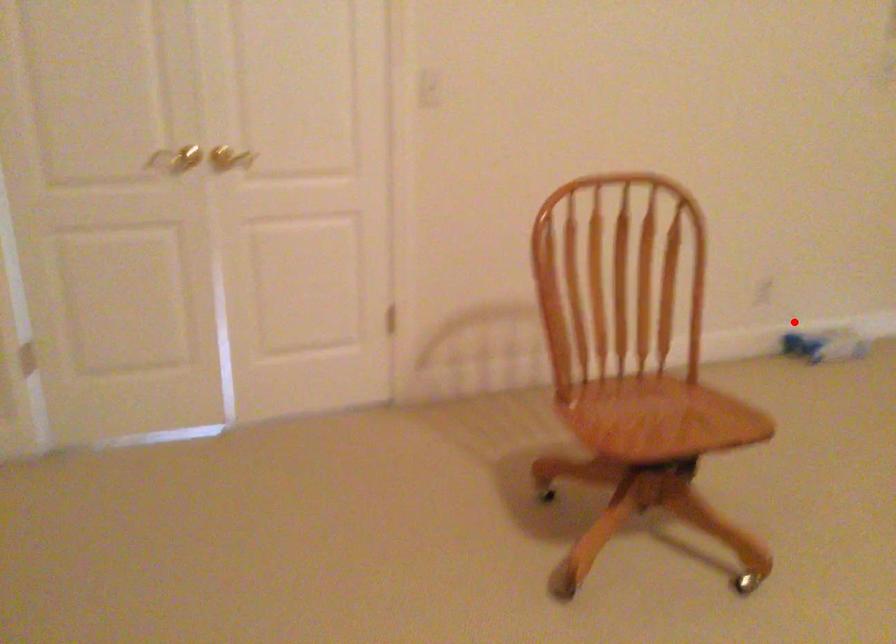
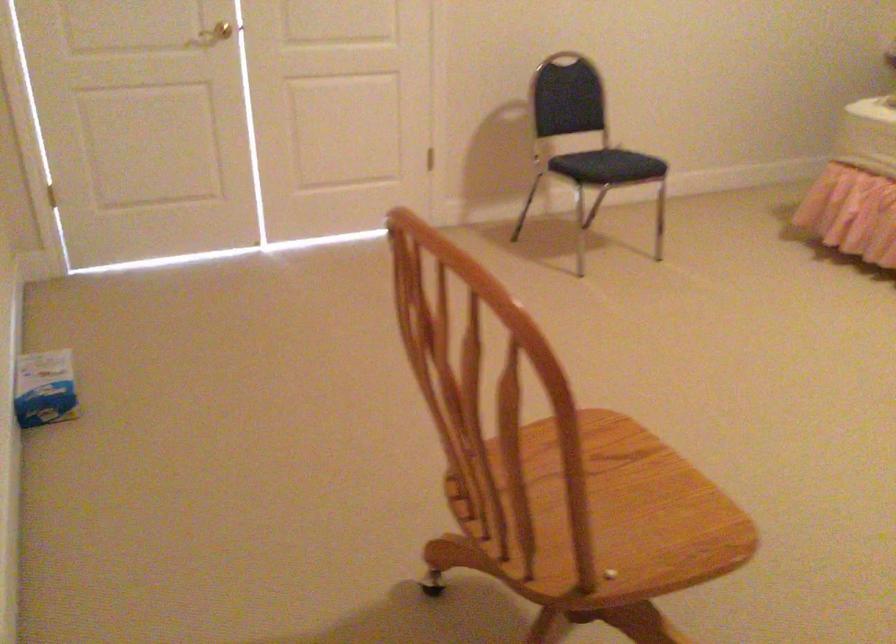
Question: I am providing you with two images of the same scene from different viewpoints. In image1, a red point is highlighted. Considering the same 3D point in image2, which of the following is correct?

Choices:
 (A) It is closer
 (B) It is farther

Answer: (A)